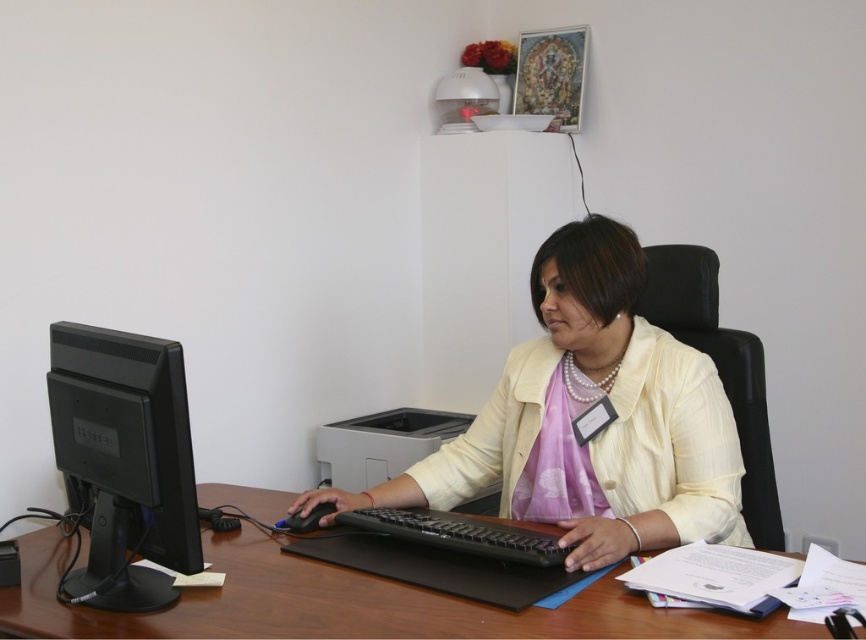
You are an office worker who needs to place a new document organizer that is 20 cm wide on your desk. The desk has limited space between the black glossy monitor at left and the black matte mouse at center. Can you fit the organizer there?

The black glossy monitor at left is bigger than the black matte mouse at center, so there might be enough space between them to fit the 20 cm wide document organizer. However, the exact dimensions of the space aren

You are standing in front of the desk and need to place two items at specific coordinates. The first item must be placed at point (692, 412) and the second at point (293, 524). Which point is closer to the woman?

Point (692, 412) is in front of point (293, 524), so the first point is closer to the woman.